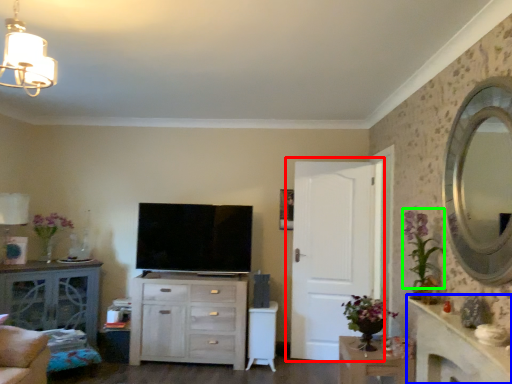
Question: Which object is positioned farthest from door (highlighted by a red box)? Select from counter top (highlighted by a blue box) and floral arrangement (highlighted by a green box).

Choices:
 (A) counter top
 (B) floral arrangement

Answer: (A)